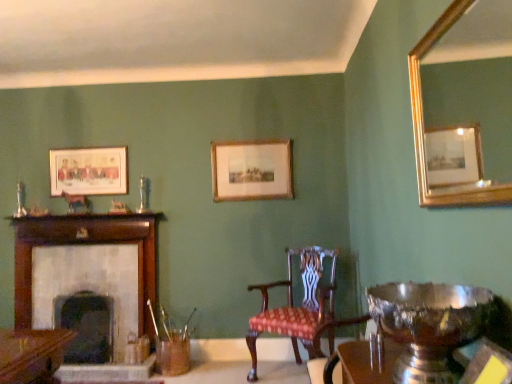
Question: Does gold-framed picture at center, which is the 2th picture frame in left-to-right order, lie behind dark gray stone fireplace at left, acting as the 2th fireplace starting from the left?

Choices:
 (A) yes
 (B) no

Answer: (A)

Question: Is gold-framed picture at center, the first picture frame from the right, not inside dark gray stone fireplace at left, the 1th fireplace in the right-to-left sequence?

Choices:
 (A) no
 (B) yes

Answer: (B)

Question: Does gold-framed picture at center, which is the 2th picture frame in left-to-right order, have a greater width compared to dark gray stone fireplace at left, the 1th fireplace in the right-to-left sequence?

Choices:
 (A) no
 (B) yes

Answer: (A)

Question: From the image's perspective, is gold-framed picture at center, acting as the 1th picture frame starting from the front, over dark gray stone fireplace at left, acting as the 2th fireplace starting from the left?

Choices:
 (A) yes
 (B) no

Answer: (A)

Question: Considering the relative sizes of gold-framed picture at center, arranged as the 2th picture frame when viewed from the back, and dark gray stone fireplace at left, the 1th fireplace in the right-to-left sequence, in the image provided, is gold-framed picture at center, arranged as the 2th picture frame when viewed from the back, taller than dark gray stone fireplace at left, the 1th fireplace in the right-to-left sequence,?

Choices:
 (A) no
 (B) yes

Answer: (A)

Question: In terms of size, does white stone fireplace at left, the 1th fireplace when ordered from left to right, appear bigger or smaller than matte wooden picture frame at upper left, which is the 2th picture frame in front-to-back order?

Choices:
 (A) big
 (B) small

Answer: (A)

Question: In terms of width, does white stone fireplace at left, the 1th fireplace when ordered from left to right, look wider or thinner when compared to matte wooden picture frame at upper left, which is the 2th picture frame in front-to-back order?

Choices:
 (A) thin
 (B) wide

Answer: (B)

Question: Is point (117, 299) closer or farther from the camera than point (59, 172)?

Choices:
 (A) farther
 (B) closer

Answer: (B)

Question: Which is correct: white stone fireplace at left, the second fireplace viewed from the right, is inside matte wooden picture frame at upper left, which is the 2th picture frame in front-to-back order, or outside of it?

Choices:
 (A) outside
 (B) inside

Answer: (A)

Question: Relative to gold-framed mirror at upper right, is dark gray stone fireplace at left, the 1th fireplace in the right-to-left sequence, in front or behind?

Choices:
 (A) front
 (B) behind

Answer: (B)

Question: Considering the positions of dark gray stone fireplace at left, the 1th fireplace in the right-to-left sequence, and gold-framed mirror at upper right in the image, is dark gray stone fireplace at left, the 1th fireplace in the right-to-left sequence, taller or shorter than gold-framed mirror at upper right?

Choices:
 (A) tall
 (B) short

Answer: (B)

Question: Considering the positions of dark gray stone fireplace at left, the 1th fireplace in the right-to-left sequence, and gold-framed mirror at upper right in the image, is dark gray stone fireplace at left, the 1th fireplace in the right-to-left sequence, wider or thinner than gold-framed mirror at upper right?

Choices:
 (A) wide
 (B) thin

Answer: (A)

Question: Considering the positions of point (98, 334) and point (413, 89), is point (98, 334) closer or farther from the camera than point (413, 89)?

Choices:
 (A) closer
 (B) farther

Answer: (B)

Question: In terms of width, does gold-framed picture at center, acting as the 1th picture frame starting from the front, look wider or thinner when compared to gold-framed mirror at upper right?

Choices:
 (A) thin
 (B) wide

Answer: (A)

Question: From the image's perspective, is gold-framed picture at center, the first picture frame from the right, above or below gold-framed mirror at upper right?

Choices:
 (A) below
 (B) above

Answer: (A)